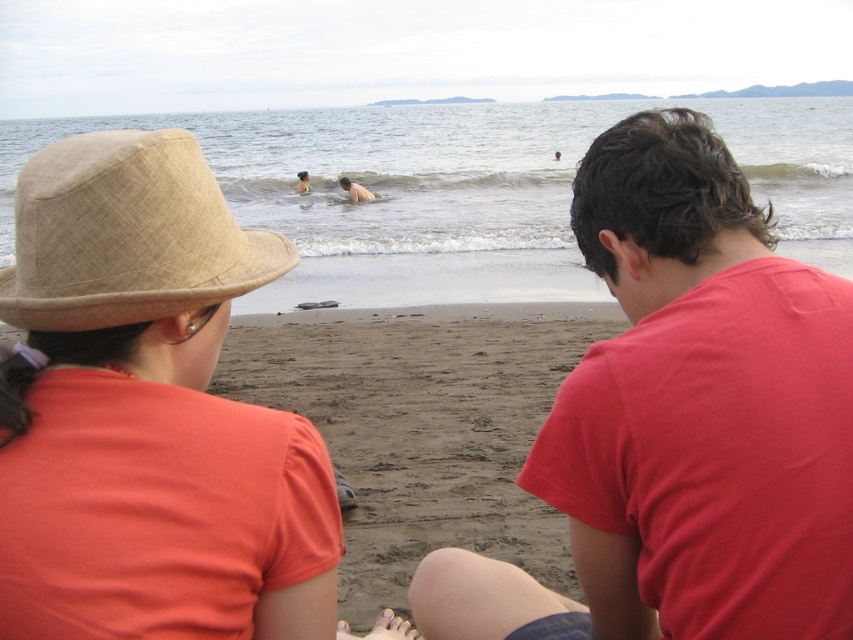
Question: Is matte beige hat at upper left closer to the viewer compared to naked skin at center?

Choices:
 (A) no
 (B) yes

Answer: (B)

Question: Estimate the real-world distances between objects in this image. Which object is closer to the beige woven hat at upper left?

Choices:
 (A) yellow rubber ring at center
 (B) brown sandy beach at center

Answer: (B)

Question: Is naked skin at center to the right of yellow rubber ring at center from the viewer's perspective?

Choices:
 (A) no
 (B) yes

Answer: (B)

Question: Which point is closer to the camera?

Choices:
 (A) (70, 212)
 (B) (782, 380)
 (C) (210, 211)

Answer: (A)

Question: Is clear water at center wider than brown sandy beach at center?

Choices:
 (A) yes
 (B) no

Answer: (A)

Question: Which is nearer to the matte beige hat at upper left?

Choices:
 (A) brown sandy beach at center
 (B) naked skin at center
 (C) clear water at center
 (D) yellow rubber ring at center

Answer: (A)